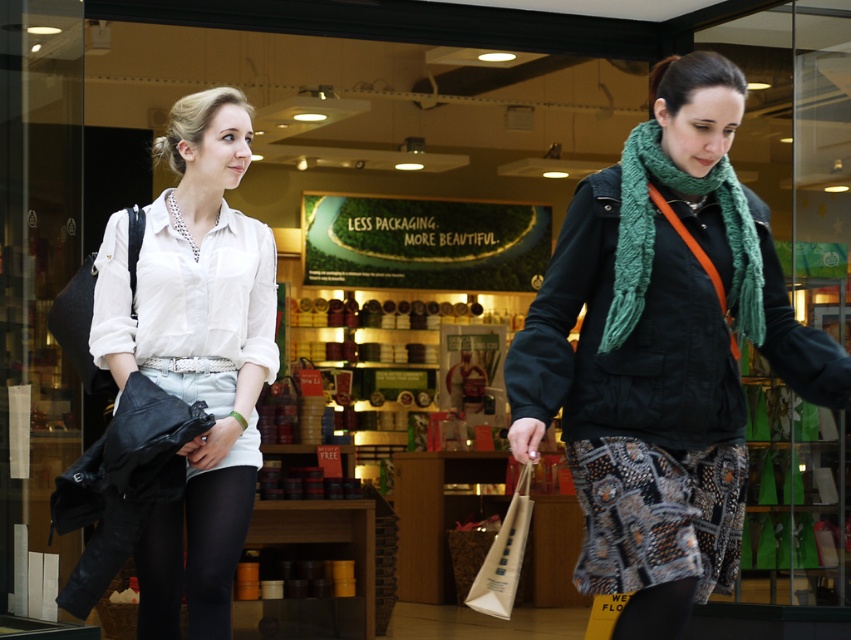
You are a delivery person who needs to deliver a package to the store. The store requires you to place the package exactly between the white matte shirt at center and the green knitted scarf at center. The package is 0.5 meters wide. Can you fit the package between them?

The distance between the white matte shirt at center and the green knitted scarf at center is 1.86 meters. Since the package is only 0.5 meters wide, there is enough space to place it between them.

You are a customer in the store and want to pick up the white paper bag at lower center. Can you reach it without moving the white matte shirt at center?

The white matte shirt at center is positioned over the white paper bag at lower center, so you cannot reach the white paper bag at lower center without moving the white matte shirt at center.